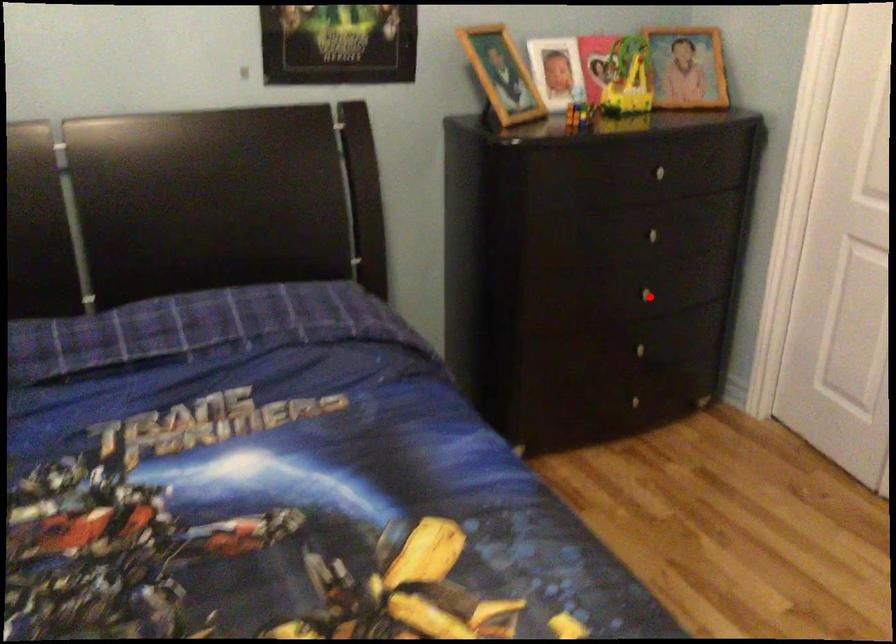
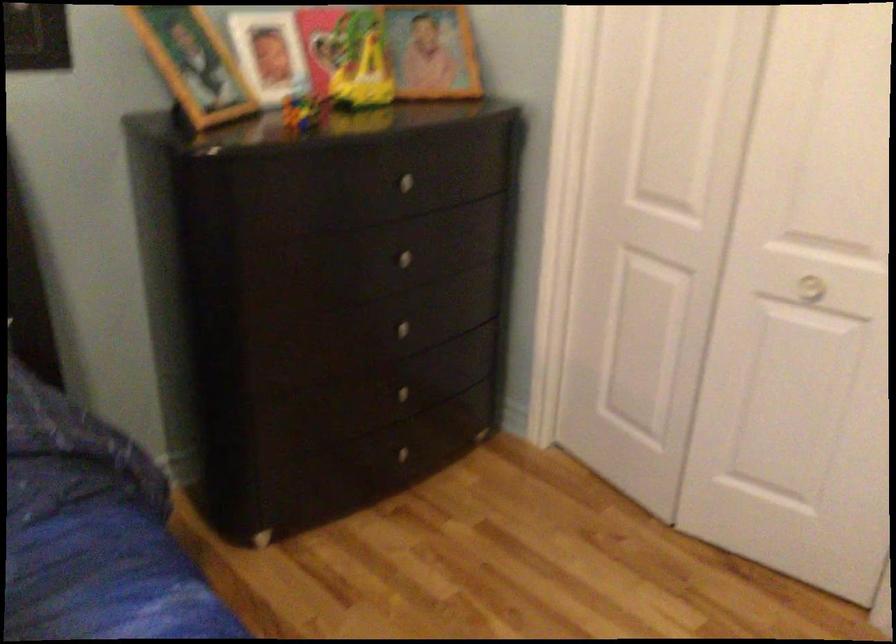
Where in the second image is the point corresponding to the highlighted location from the first image?

(409, 332)